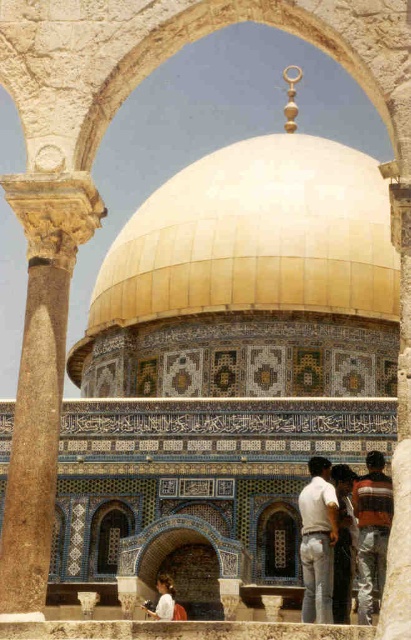
Is gold mosaic dome at center thinner than white cotton shirt at lower center?

No.

Between gold mosaic dome at center and white cotton shirt at lower center, which one is positioned lower?

white cotton shirt at lower center is below.

Between point (369, 205) and point (154, 616), which one is positioned behind?

Point (369, 205)

At what (x,y) coordinates should I click in order to perform the action: click on gold mosaic dome at center. Please return your answer as a coordinate pair (x, y). The height and width of the screenshot is (640, 411). Looking at the image, I should click on (240, 257).

Can you confirm if gold mosaic dome at center is thinner than white cotton shirt at center?

In fact, gold mosaic dome at center might be wider than white cotton shirt at center.

Can you confirm if gold mosaic dome at center is shorter than white cotton shirt at center?

No, gold mosaic dome at center is not shorter than white cotton shirt at center.

Identify the location of gold mosaic dome at center. This screenshot has width=411, height=640. (240, 257).

Locate an element on the screen. Image resolution: width=411 pixels, height=640 pixels. gold mosaic dome at center is located at coordinates (240, 257).

Between point (46, 232) and point (311, 531), which one is positioned in front?

Positioned in front is point (46, 232).

How much distance is there between brown stone column at left and white cotton shirt at center?

brown stone column at left is 10.79 meters from white cotton shirt at center.

Identify the location of brown stone column at left. The width and height of the screenshot is (411, 640). 41,374.

Identify the location of brown stone column at left. The image size is (411, 640). point(41,374).